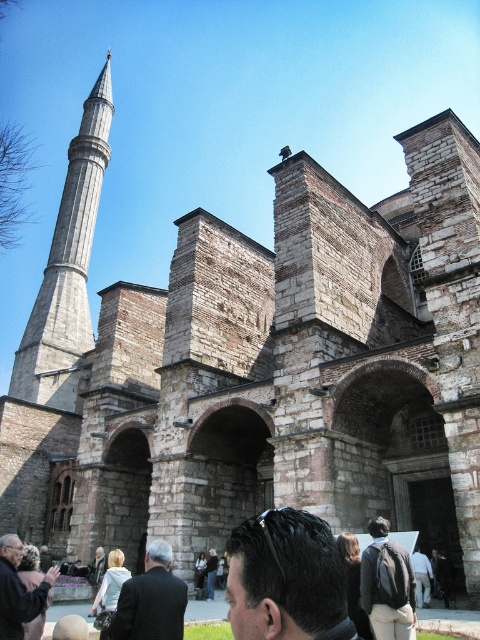
Question: Which point is closer to the camera?

Choices:
 (A) (381, 600)
 (B) (98, 184)
 (C) (304, 563)
 (D) (149, 556)

Answer: (C)

Question: Can you confirm if gray stone minaret at left is thinner than dark brown hair at center?

Choices:
 (A) yes
 (B) no

Answer: (B)

Question: In this image, where is dark brown hair at center located relative to dark brown leather jacket at lower left?

Choices:
 (A) above
 (B) below

Answer: (B)

Question: Among these objects, which one is farthest from the camera?

Choices:
 (A) dark brown leather jacket at lower left
 (B) dark brown backpack at lower right
 (C) gray stone minaret at left
 (D) dark brown hair at center

Answer: (C)

Question: Which object is closer to the camera taking this photo?

Choices:
 (A) dark brown hair at center
 (B) dark brown leather jacket at lower left

Answer: (A)

Question: Where is dark brown leather jacket at lower center located in relation to dark brown leather jacket at lower left in the image?

Choices:
 (A) above
 (B) below

Answer: (B)